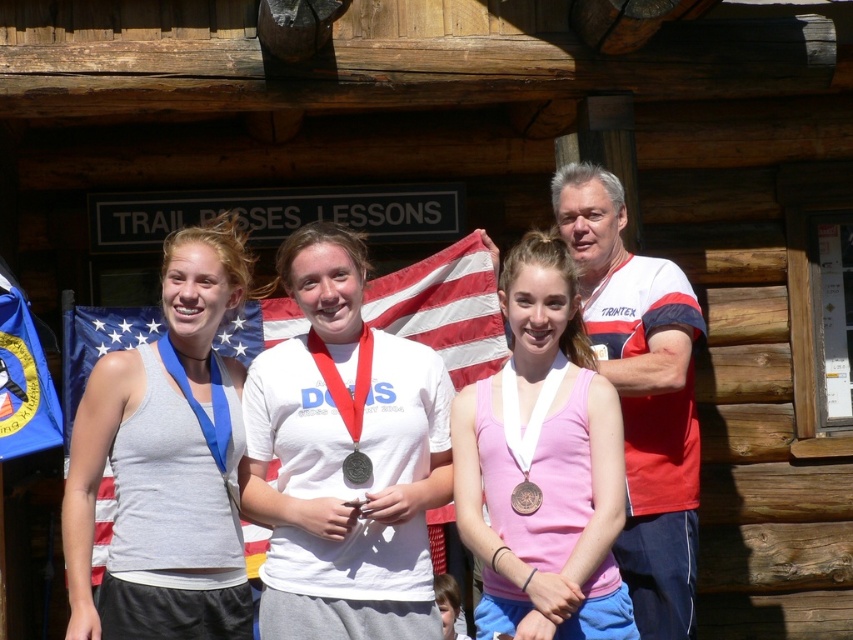
You are a photographer who needs to capture a clear image of both the matte gray tank top at center and the gold metallic medal at center. Since the medal is smaller, which object should you focus on first to ensure proper framing?

The matte gray tank top at center is larger in size than the gold metallic medal at center, so you should focus on the gold metallic medal at center first to ensure it is properly framed before adjusting for the larger tank top.

You are organizing a photo shoot and need to ensure that the matte gray tank top at center and the gold metallic medal at center are visible in the frame. Based on their sizes, which object might require more space horizontally to be fully captured?

The matte gray tank top at center might require more space horizontally since it is wider than the gold metallic medal at center according to the description.